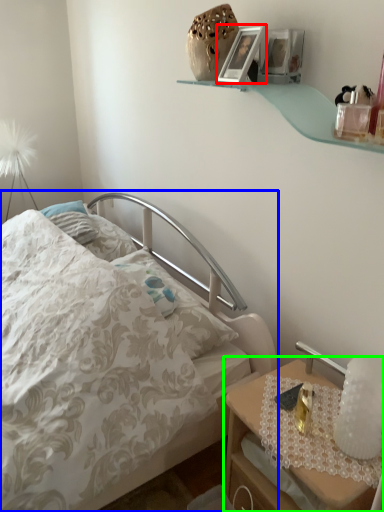
Question: Which is nearer to the picture frame (highlighted by a red box)? bed (highlighted by a blue box) or nightstand (highlighted by a green box).

Choices:
 (A) bed
 (B) nightstand

Answer: (A)